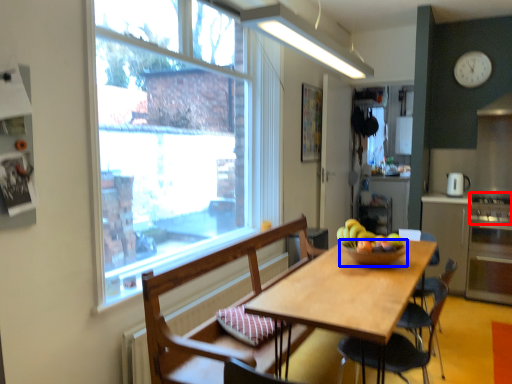
Question: Which object is further to the camera taking this photo, stove (highlighted by a red box) or bowl (highlighted by a blue box)?

Choices:
 (A) stove
 (B) bowl

Answer: (A)